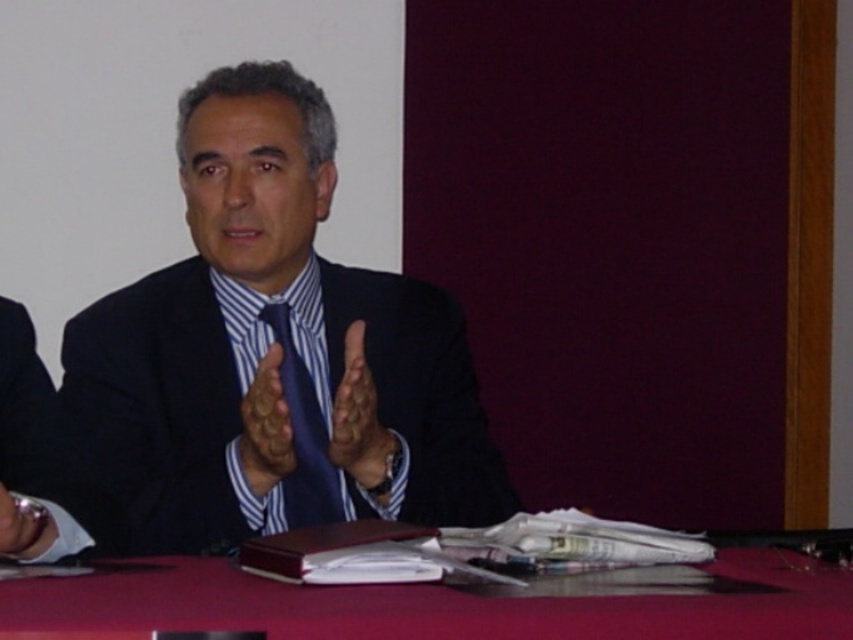
Can you confirm if matte blue tie at center is taller than matte black hand at center?

Correct, matte blue tie at center is much taller as matte black hand at center.

Does point (283, 472) come closer to viewer compared to point (12, 497)?

No, it is behind (12, 497).

Locate an element on the screen. The width and height of the screenshot is (853, 640). matte blue tie at center is located at coordinates tap(265, 426).

Is point (584, 598) positioned after point (306, 449)?

No.

The height and width of the screenshot is (640, 853). Find the location of `smooth red table at center`. smooth red table at center is located at coordinates [x=445, y=604].

Does point (192, 362) lie behind point (534, 602)?

Yes, point (192, 362) is behind point (534, 602).

Find the location of a particular element. This screenshot has height=640, width=853. dark blue suit at center is located at coordinates (270, 346).

This screenshot has height=640, width=853. Identify the location of dark blue suit at center. (270, 346).